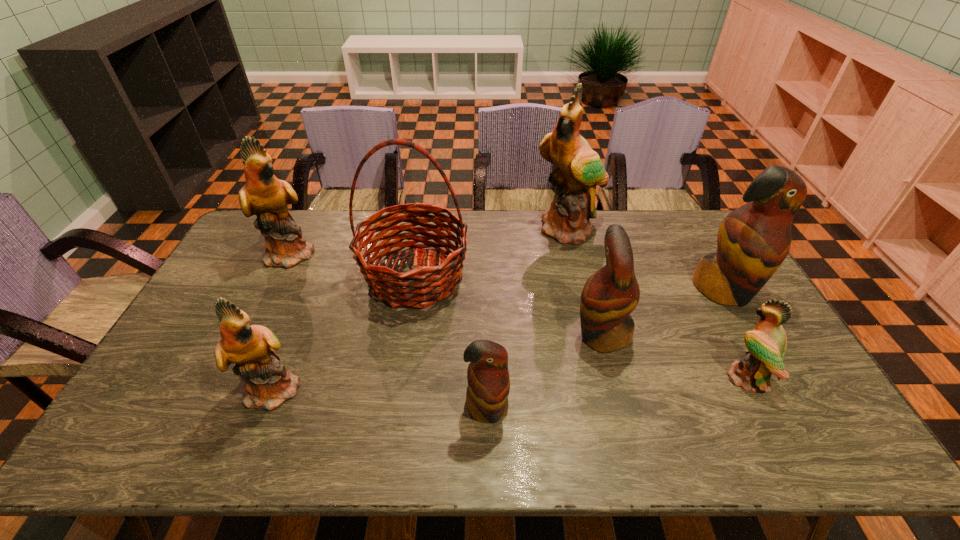
Image resolution: width=960 pixels, height=540 pixels. What are the coordinates of `vacant space at the left edge of the desktop` in the screenshot? It's located at (265, 281).

Image resolution: width=960 pixels, height=540 pixels. What are the coordinates of `vacant space at the near right corner of the desktop` in the screenshot? It's located at (815, 444).

Where is `empty space between the farthest red parrot and the biggest green parrot`? This screenshot has width=960, height=540. empty space between the farthest red parrot and the biggest green parrot is located at coordinates (646, 260).

The height and width of the screenshot is (540, 960). Find the location of `free space between the second smallest green parrot and the smallest green parrot`. free space between the second smallest green parrot and the smallest green parrot is located at coordinates (511, 383).

Identify the location of free space between the second red parrot from left to right and the second smallest green parrot. (439, 361).

You are a GUI agent. You are given a task and a screenshot of the screen. Output one action in this format:
    pyautogui.click(x=<x>, y=<y>)
    Task: Click on the blank region between the third smallest green parrot and the third biggest green parrot
    The height and width of the screenshot is (540, 960).
    Given the screenshot: What is the action you would take?
    click(x=284, y=321)

Where is `vacant area that lies between the rightmost red parrot and the second farthest red parrot`? This screenshot has height=540, width=960. vacant area that lies between the rightmost red parrot and the second farthest red parrot is located at coordinates (662, 312).

Find the location of a particular element. free spot between the basket and the fourth farthest parrot is located at coordinates (509, 305).

At what (x,y) coordinates should I click in order to perform the action: click on vacant space that is in between the smallest green parrot and the third smallest green parrot. Please return your answer as a coordinate pair (x, y). The width and height of the screenshot is (960, 540). Looking at the image, I should click on (518, 315).

At what (x,y) coordinates should I click in order to perform the action: click on free space between the basket and the third biggest green parrot. Please return your answer as a coordinate pair (x, y). This screenshot has height=540, width=960. Looking at the image, I should click on (346, 332).